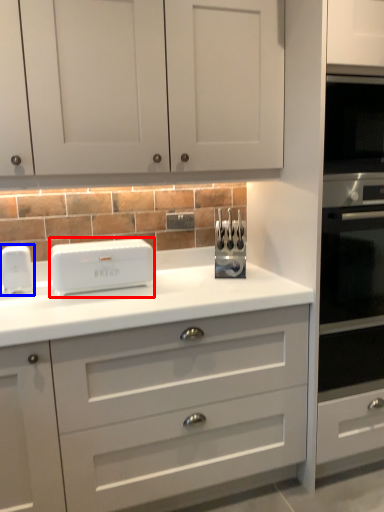
Question: Which object appears farthest to the camera in this image, home appliance (highlighted by a red box) or home appliance (highlighted by a blue box)?

Choices:
 (A) home appliance
 (B) home appliance

Answer: (B)